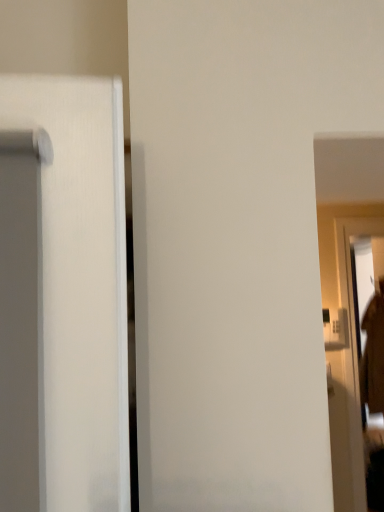
Question: Could you tell me if brown fuzzy robe at right is facing clear glass screen door at right?

Choices:
 (A) yes
 (B) no

Answer: (B)

Question: Is brown fuzzy robe at right looking in the opposite direction of clear glass screen door at right?

Choices:
 (A) yes
 (B) no

Answer: (B)

Question: Is the position of brown fuzzy robe at right less distant than that of clear glass screen door at right?

Choices:
 (A) no
 (B) yes

Answer: (A)

Question: Does brown fuzzy robe at right have a larger size compared to clear glass screen door at right?

Choices:
 (A) yes
 (B) no

Answer: (A)

Question: Is brown fuzzy robe at right to the right of clear glass screen door at right from the viewer's perspective?

Choices:
 (A) yes
 (B) no

Answer: (A)

Question: Considering the relative sizes of brown fuzzy robe at right and clear glass screen door at right in the image provided, is brown fuzzy robe at right shorter than clear glass screen door at right?

Choices:
 (A) yes
 (B) no

Answer: (A)

Question: Is the position of clear glass screen door at right more distant than that of brown fuzzy robe at right?

Choices:
 (A) no
 (B) yes

Answer: (A)

Question: Are clear glass screen door at right and brown fuzzy robe at right beside each other?

Choices:
 (A) yes
 (B) no

Answer: (B)

Question: Considering the relative sizes of clear glass screen door at right and brown fuzzy robe at right in the image provided, is clear glass screen door at right taller than brown fuzzy robe at right?

Choices:
 (A) yes
 (B) no

Answer: (A)

Question: Is clear glass screen door at right shorter than brown fuzzy robe at right?

Choices:
 (A) yes
 (B) no

Answer: (B)

Question: From the image's perspective, is clear glass screen door at right located above brown fuzzy robe at right?

Choices:
 (A) yes
 (B) no

Answer: (A)

Question: Does clear glass screen door at right have a greater width compared to brown fuzzy robe at right?

Choices:
 (A) no
 (B) yes

Answer: (A)

Question: Considering their positions, is clear glass screen door at right located in front of or behind brown fuzzy robe at right?

Choices:
 (A) behind
 (B) front

Answer: (B)